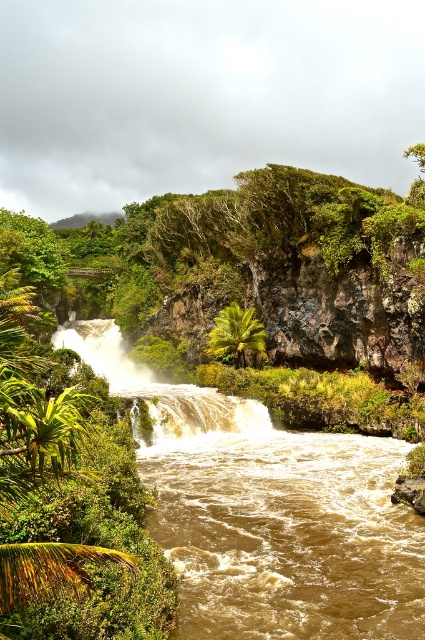
Question: Which object is closer to the camera taking this photo?

Choices:
 (A) green leafy palm tree at center
 (B) brown textured waterfall at center

Answer: (B)

Question: Where is brown textured waterfall at center located in relation to green leafy palm tree at center in the image?

Choices:
 (A) left
 (B) right

Answer: (A)

Question: Is brown textured waterfall at center behind green leafy palm tree at center?

Choices:
 (A) yes
 (B) no

Answer: (B)

Question: From the image, what is the correct spatial relationship of brown textured waterfall at center in relation to green leafy palm tree at center?

Choices:
 (A) below
 (B) above

Answer: (A)